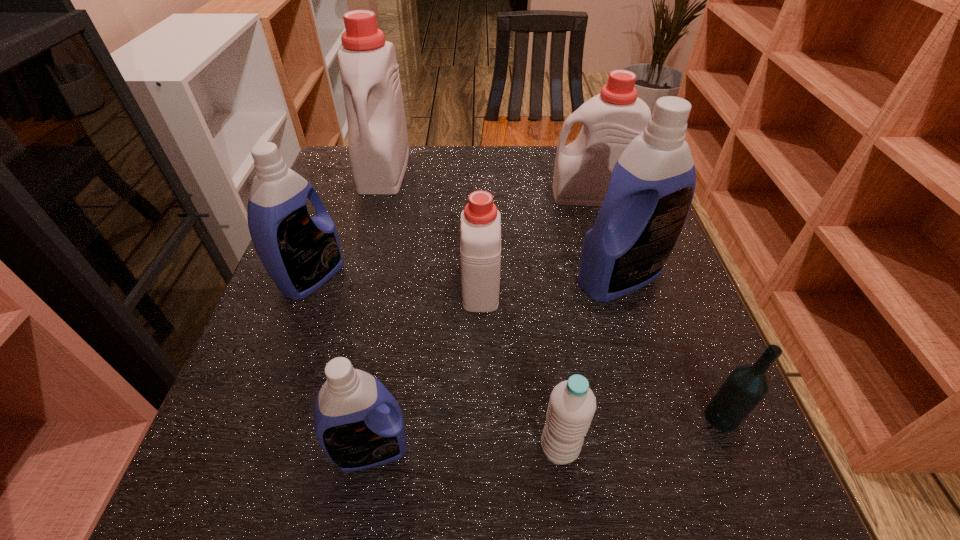
You are a GUI agent. You are given a task and a screenshot of the screen. Output one action in this format:
    pyautogui.click(x=<x>, y=<y>)
    Task: Click on the vacant space that satisfies the following two spatial constraints: 1. on the handle side of the rightmost blue detergent; 2. on the left side of the second biggest white detergent
    This screenshot has height=540, width=960.
    Given the screenshot: What is the action you would take?
    pyautogui.click(x=615, y=278)

At what (x,y) coordinates should I click in order to perform the action: click on vacant area in the image that satisfies the following two spatial constraints: 1. on the handle side of the second smallest white detergent; 2. on the right side of the black vodka. Please return your answer as a coordinate pair (x, y). The image size is (960, 540). Looking at the image, I should click on (657, 417).

What are the coordinates of `free space in the image that satisfies the following two spatial constraints: 1. on the handle side of the second smallest white detergent; 2. on the front side of the fifth object from left to right` in the screenshot? It's located at [x=665, y=448].

This screenshot has width=960, height=540. In order to click on free spot that satisfies the following two spatial constraints: 1. on the handle side of the nearest white detergent; 2. on the left side of the rightmost blue detergent in this screenshot , I will do `click(481, 278)`.

You are a GUI agent. You are given a task and a screenshot of the screen. Output one action in this format:
    pyautogui.click(x=<x>, y=<y>)
    Task: Click on the free space that satisfies the following two spatial constraints: 1. on the handle side of the nearest blue detergent; 2. on the left side of the biggest white detergent
    This screenshot has width=960, height=540.
    Given the screenshot: What is the action you would take?
    pyautogui.click(x=307, y=449)